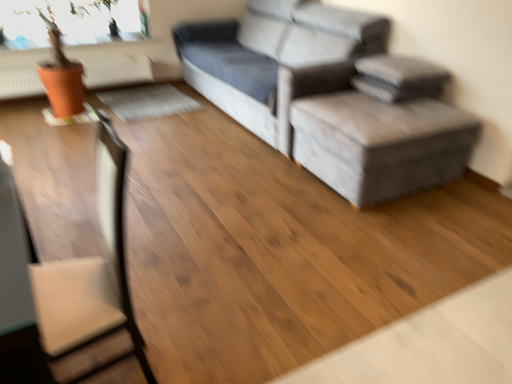
The height and width of the screenshot is (384, 512). What are the coordinates of `vacant space that is in between gray fabric ottoman at center and gray fabric couch at upper right` in the screenshot? It's located at (301, 175).